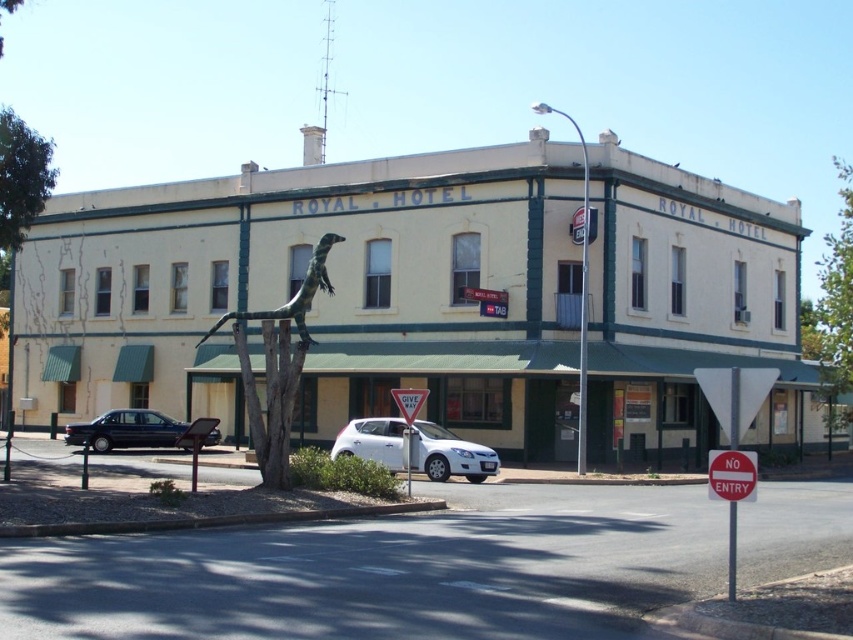
Question: Does green textured lizard at center appear under red plastic sign at center?

Choices:
 (A) no
 (B) yes

Answer: (A)

Question: Which point is farther to the camera?

Choices:
 (A) (96, 444)
 (B) (474, 461)

Answer: (A)

Question: Is red plastic sign at center smaller than red plastic give way sign at center?

Choices:
 (A) no
 (B) yes

Answer: (B)

Question: Is white matte hatchback at center thinner than white plastic triangle at center?

Choices:
 (A) no
 (B) yes

Answer: (B)

Question: Which of the following is the closest to the observer?

Choices:
 (A) white matte hatchback at center
 (B) red plastic sign at center

Answer: (B)

Question: Which point is farther from the camera taking this photo?

Choices:
 (A) (294, 316)
 (B) (165, 438)
 (C) (433, 467)

Answer: (B)